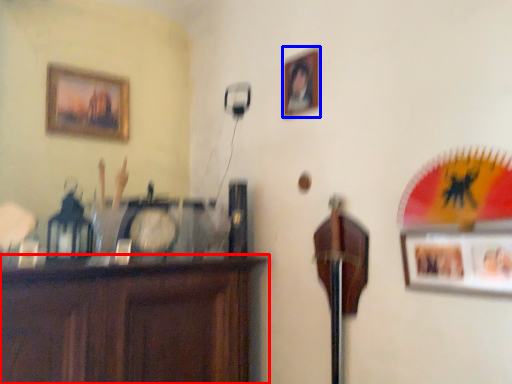
Question: Which object is further to the camera taking this photo, furniture (highlighted by a red box) or picture frame (highlighted by a blue box)?

Choices:
 (A) furniture
 (B) picture frame

Answer: (B)